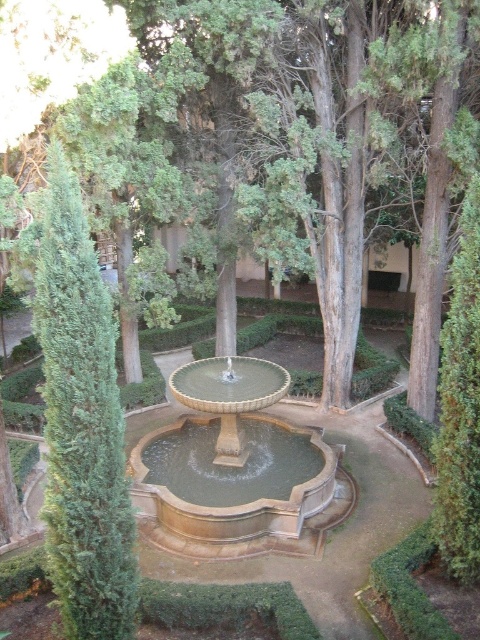
Measure the distance between green leafy tree at center and camera.

green leafy tree at center is 10.99 meters from camera.

Who is more distant from viewer, (271, 49) or (332, 488)?

Positioned behind is point (271, 49).

Locate an element on the screen. Image resolution: width=480 pixels, height=640 pixels. green leafy tree at center is located at coordinates [x=319, y=136].

What are the coordinates of `green textured bush at left` in the screenshot? It's located at (82, 422).

Which is more to the left, green textured bush at left or stone fountain at center?

green textured bush at left is more to the left.

Is point (48, 378) farther from camera compared to point (219, 365)?

No, (48, 378) is closer to viewer.

I want to click on green textured bush at left, so click(82, 422).

Does green leafy tree at center have a smaller size compared to green textured bush at left?

Incorrect, green leafy tree at center is not smaller in size than green textured bush at left.

Is green leafy tree at center positioned at the back of green textured bush at left?

Yes, green leafy tree at center is behind green textured bush at left.

The image size is (480, 640). Describe the element at coordinates (319, 136) in the screenshot. I see `green leafy tree at center` at that location.

Identify the location of green leafy tree at center. (319, 136).